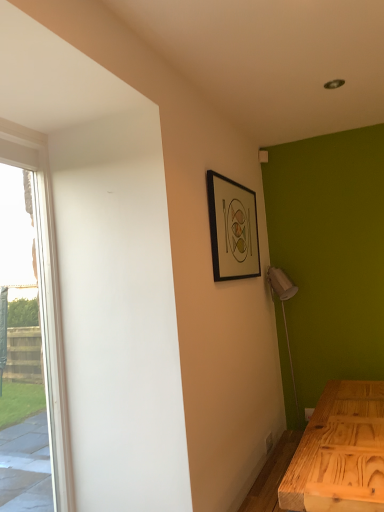
Question: Can you confirm if black matte picture frame at upper right is wider than clear glass window at left?

Choices:
 (A) yes
 (B) no

Answer: (B)

Question: Is black matte picture frame at upper right not close to clear glass window at left?

Choices:
 (A) no
 (B) yes

Answer: (A)

Question: From the image's perspective, does black matte picture frame at upper right appear higher than clear glass window at left?

Choices:
 (A) yes
 (B) no

Answer: (A)

Question: Is black matte picture frame at upper right oriented away from clear glass window at left?

Choices:
 (A) yes
 (B) no

Answer: (B)

Question: Is black matte picture frame at upper right taller than clear glass window at left?

Choices:
 (A) yes
 (B) no

Answer: (B)

Question: Considering the relative positions of black matte picture frame at upper right and clear glass window at left in the image provided, is black matte picture frame at upper right behind clear glass window at left?

Choices:
 (A) yes
 (B) no

Answer: (A)

Question: From a real-world perspective, is clear glass window at left physically above black matte picture frame at upper right?

Choices:
 (A) yes
 (B) no

Answer: (B)

Question: Is clear glass window at left located outside black matte picture frame at upper right?

Choices:
 (A) no
 (B) yes

Answer: (B)

Question: Considering the relative sizes of clear glass window at left and black matte picture frame at upper right in the image provided, is clear glass window at left bigger than black matte picture frame at upper right?

Choices:
 (A) no
 (B) yes

Answer: (B)

Question: Does clear glass window at left have a greater height compared to black matte picture frame at upper right?

Choices:
 (A) yes
 (B) no

Answer: (A)

Question: From the image's perspective, is clear glass window at left above black matte picture frame at upper right?

Choices:
 (A) yes
 (B) no

Answer: (B)

Question: Can you confirm if clear glass window at left is wider than black matte picture frame at upper right?

Choices:
 (A) yes
 (B) no

Answer: (A)

Question: Considering the positions of black matte picture frame at upper right and clear glass window at left in the image, is black matte picture frame at upper right taller or shorter than clear glass window at left?

Choices:
 (A) short
 (B) tall

Answer: (A)